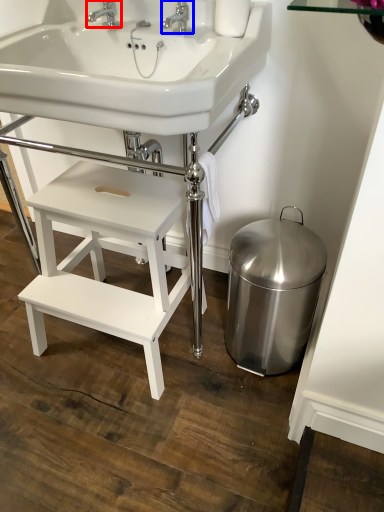
Question: Which object appears closest to the camera in this image, tap (highlighted by a red box) or tap (highlighted by a blue box)?

Choices:
 (A) tap
 (B) tap

Answer: (B)